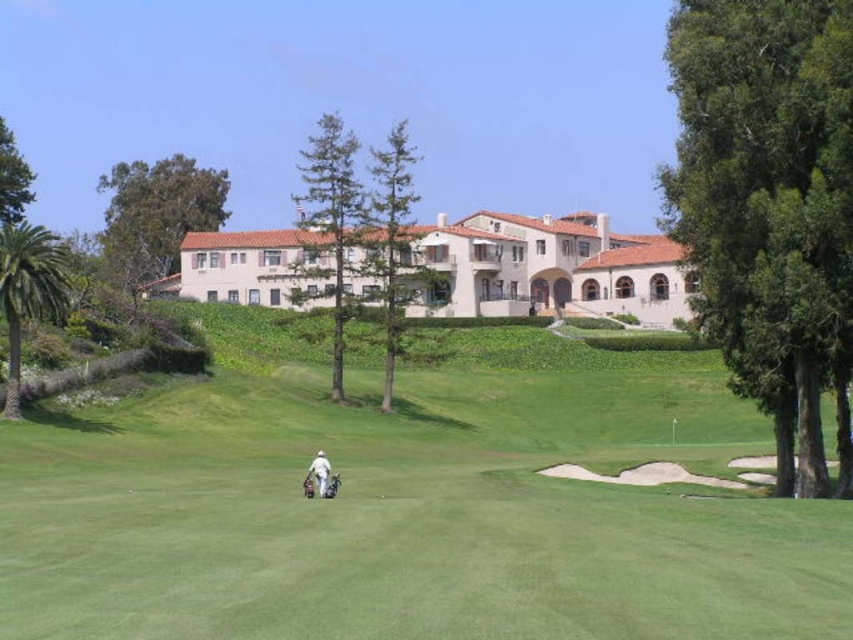
Between green grassy golf course at center and white fabric golf bag at center, which one has less height?

white fabric golf bag at center is shorter.

Between point (614, 413) and point (315, 461), which one is positioned behind?

Positioned behind is point (614, 413).

Identify the location of green grassy golf course at center. (409, 516).